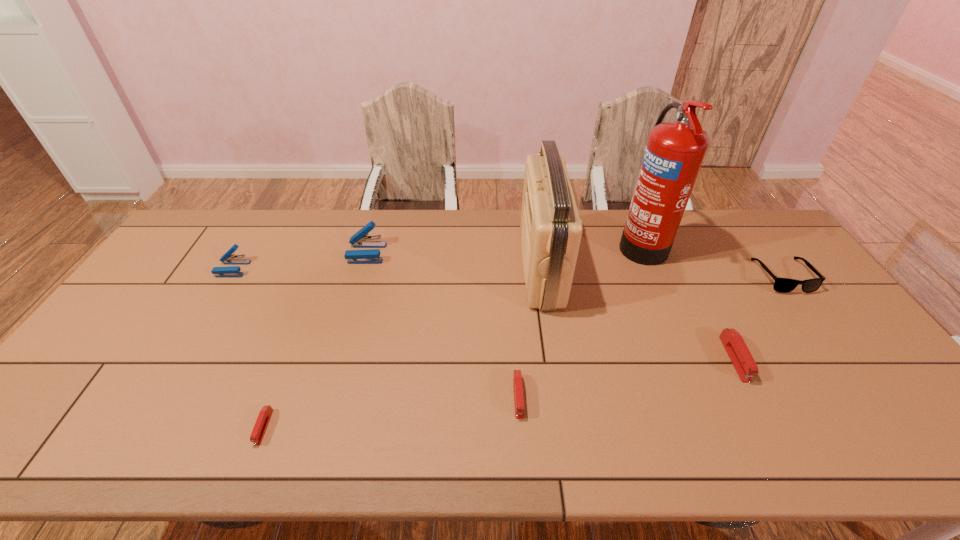
This screenshot has width=960, height=540. In order to click on blank space located on the front-facing side of the beige radio receiver in this screenshot , I will do `click(503, 268)`.

Locate an element on the screen. The width and height of the screenshot is (960, 540). free space located on the right of the right blue stapler is located at coordinates (418, 253).

Identify the location of blank area located on the right of the smaller blue stapler. The image size is (960, 540). (369, 269).

Identify the location of vacant space located 0.200m on the front-facing side of the rightmost object. (835, 348).

Find the location of a particular element. Image resolution: width=960 pixels, height=540 pixels. vacant space located 0.180m on the front-facing side of the third tallest stapler is located at coordinates click(783, 453).

Image resolution: width=960 pixels, height=540 pixels. I want to click on fire extinguisher positioned at the far edge, so click(x=674, y=152).

Locate an element on the screen. This screenshot has width=960, height=540. radio receiver situated at the far edge is located at coordinates [551, 229].

You are a GUI agent. You are given a task and a screenshot of the screen. Output one action in this format:
    pyautogui.click(x=<x>, y=<y>)
    Task: Click on the stapler present at the far edge
    The image size is (960, 540).
    Given the screenshot: What is the action you would take?
    pyautogui.click(x=360, y=239)

You are a GUI agent. You are given a task and a screenshot of the screen. Output one action in this format:
    pyautogui.click(x=<x>, y=<y>)
    Task: Click on the object at the near edge
    The image size is (960, 540).
    Given the screenshot: What is the action you would take?
    pyautogui.click(x=264, y=416)

The image size is (960, 540). In order to click on object located at the right edge in this screenshot , I will do `click(783, 285)`.